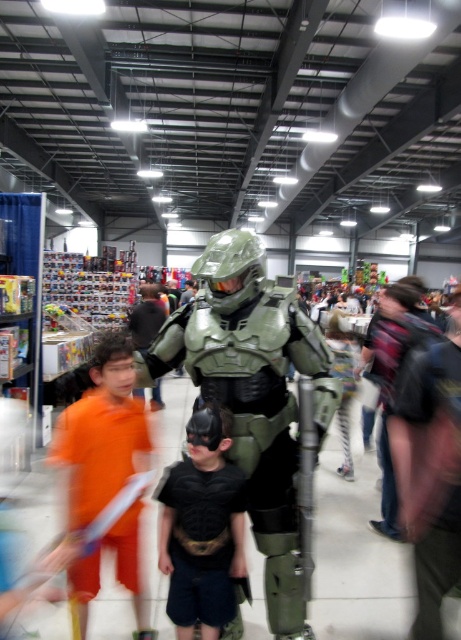
You are a photographer setting up a shoot in this convention space. You need to position a light source so that it illuminates both the green matte armor at center and the dark brown leather backpack at center right without casting shadows on the background wall. Considering their sizes, which object should be placed closer to the light source to achieve even lighting?

The green matte armor at center is taller than the dark brown leather backpack at center right. To ensure even lighting and avoid shadows, the taller green matte armor at center should be positioned closer to the light source. This adjustment compensates for its greater height, allowing both objects to receive adequate illumination while minimizing shadow casting on the background wall.

You are standing at point (146, 337) and want to walk to point (99, 448). Which direction should you move?

You should move forward because point (99, 448) is in front of point (146, 337).